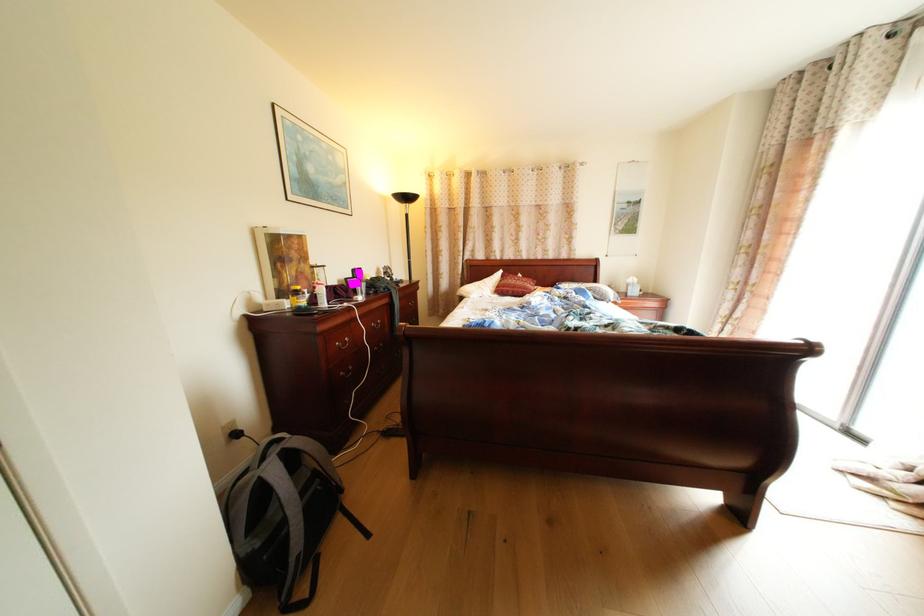
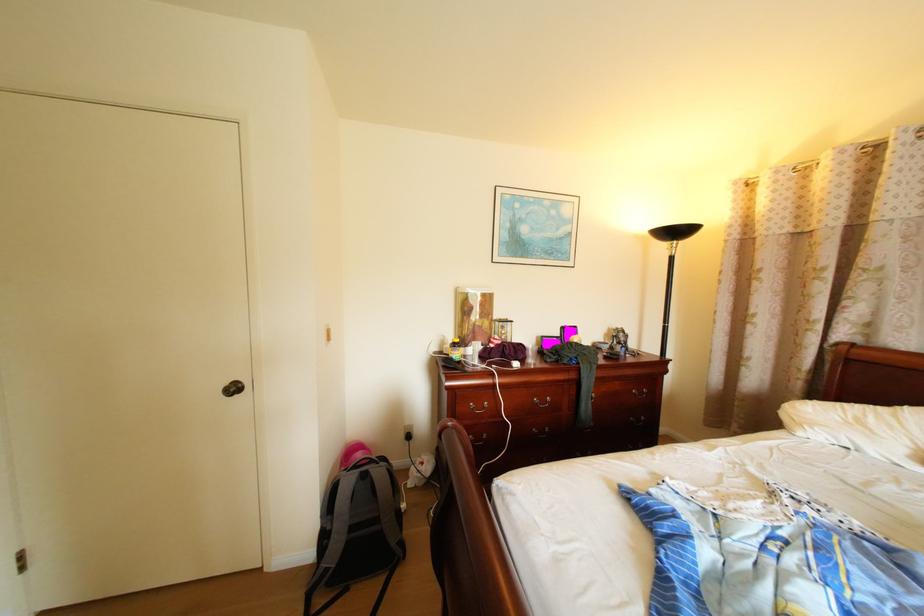
In the second image, find the point that corresponds to pixel 272 546 in the first image.

(342, 529)